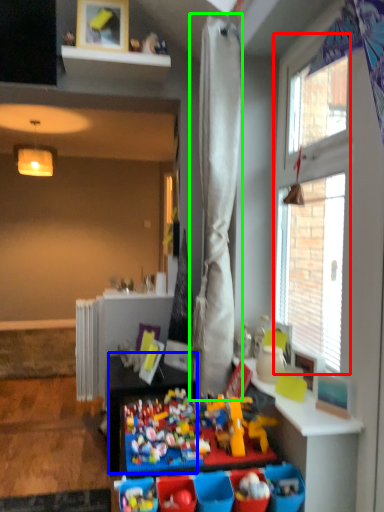
Question: Which is nearer to the window (highlighted by a red box)? table (highlighted by a blue box) or curtain (highlighted by a green box).

Choices:
 (A) table
 (B) curtain

Answer: (B)